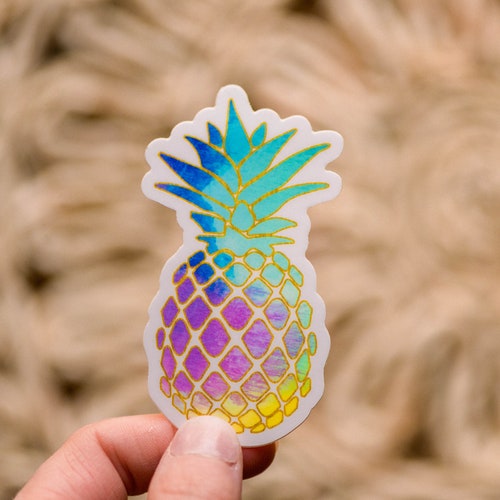
I want to click on sticker, so click(x=250, y=336).